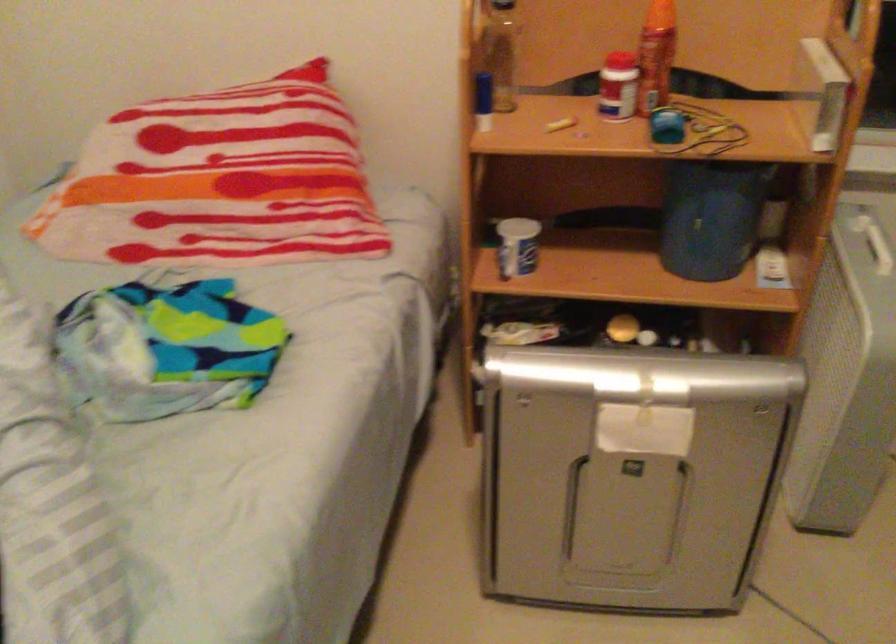
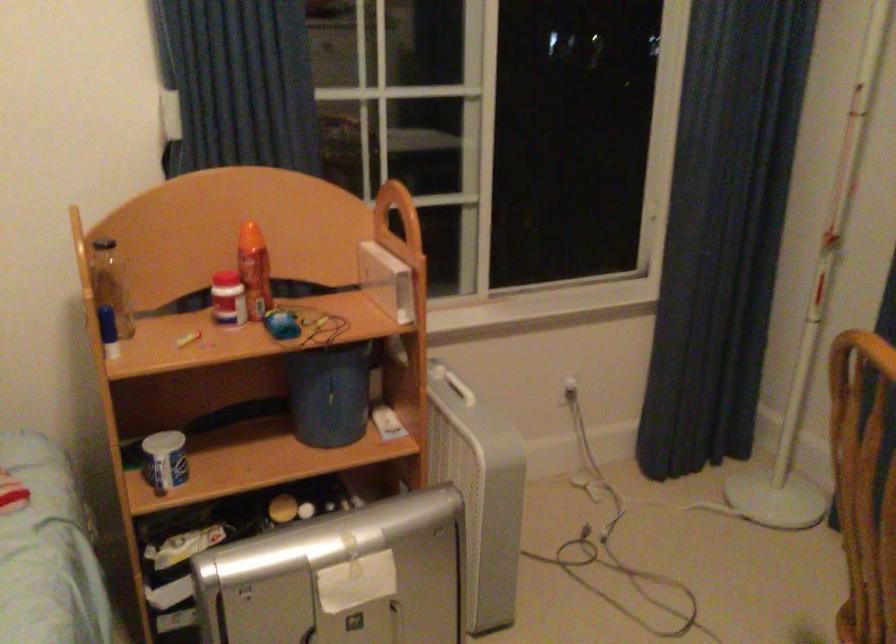
Question: The images are taken continuously from a first-person perspective. In which direction is your viewpoint rotating?

Choices:
 (A) Left
 (B) Right
 (C) Up
 (D) Down

Answer: (B)